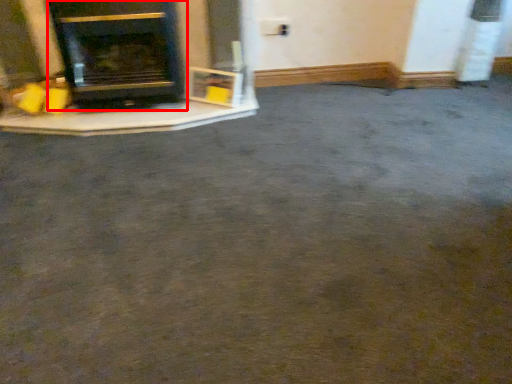
Question: Considering the relative positions of wood burning stove (annotated by the red box) and fireplace in the image provided, where is wood burning stove (annotated by the red box) located with respect to the staircase?

Choices:
 (A) right
 (B) left

Answer: (A)